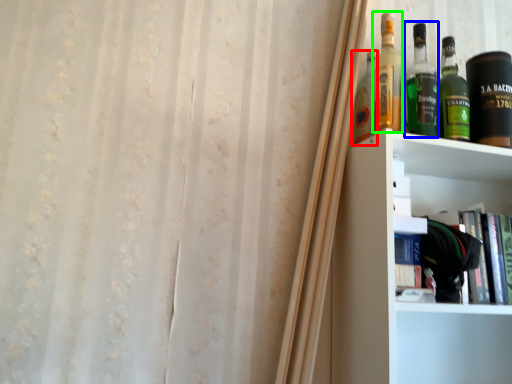
Question: Based on their relative distances, which object is nearer to bottle (highlighted by a red box)? Choose from bottle (highlighted by a blue box) and bottle (highlighted by a green box).

Choices:
 (A) bottle
 (B) bottle

Answer: (B)